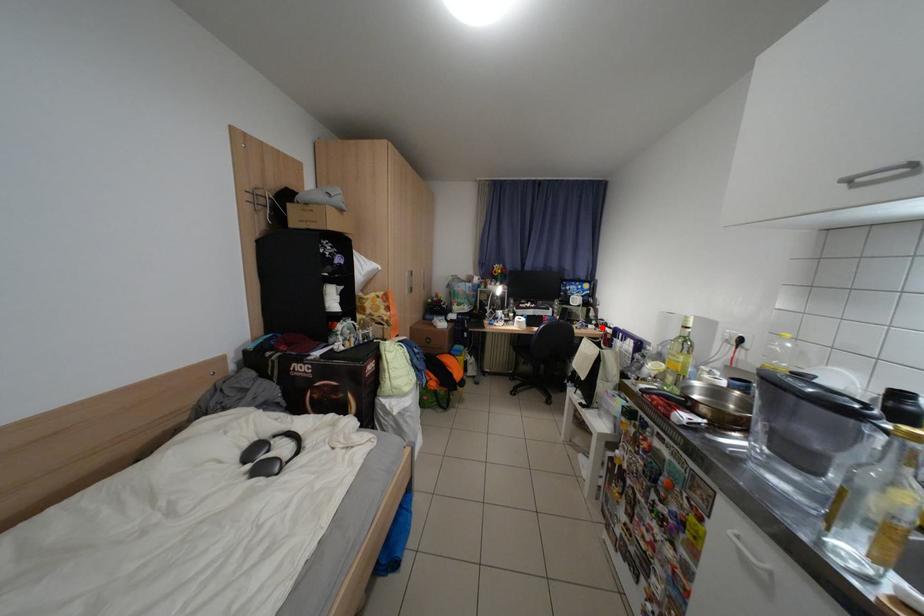
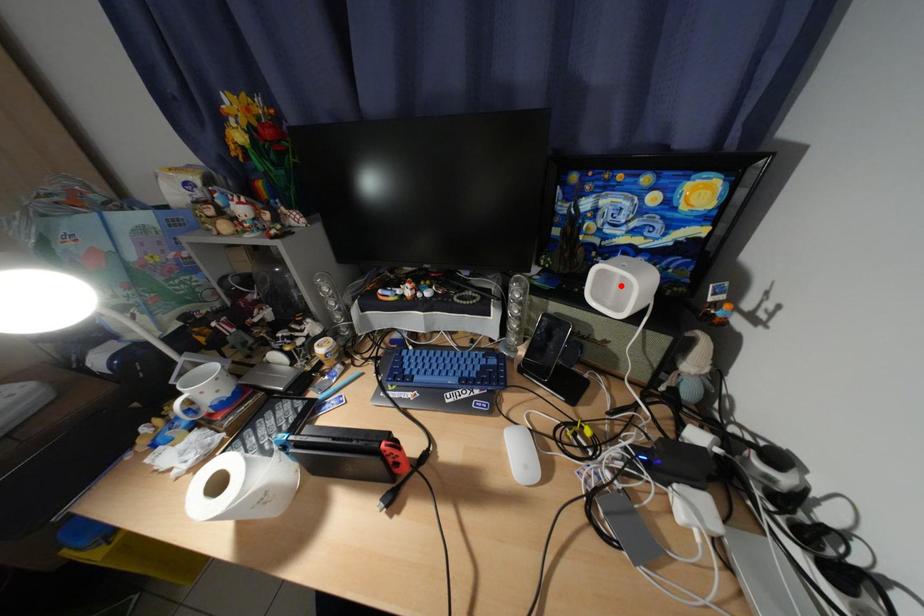
I am providing you with two images of the same scene from different viewpoints. A red point is marked on the first image and another point is marked on the second image. Do the highlighted points in image1 and image2 indicate the same real-world spot?

No